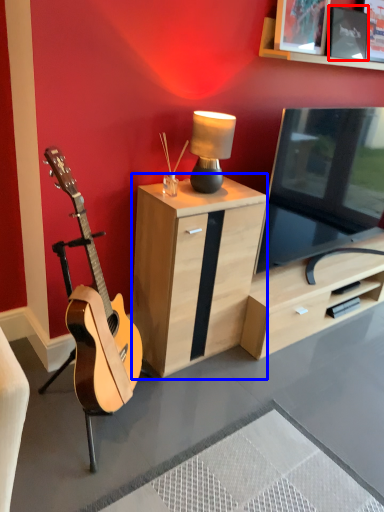
Question: Which point is further to the camera, picture frame (highlighted by a red box) or cabinetry (highlighted by a blue box)?

Choices:
 (A) picture frame
 (B) cabinetry

Answer: (A)